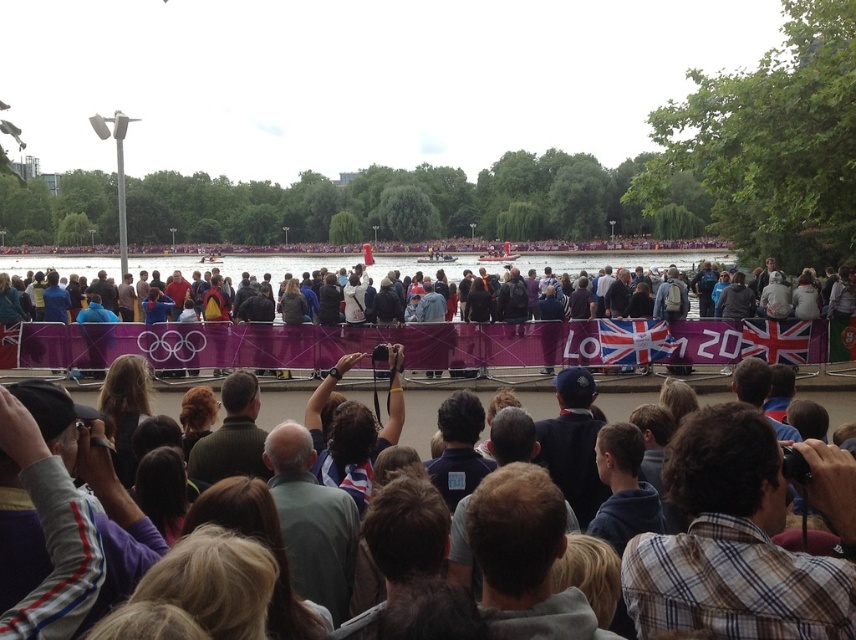
Is brown hair at center taller than light brown hair at center?

Yes, brown hair at center is taller than light brown hair at center.

Is brown hair at center behind light brown hair at center?

No, it is in front of light brown hair at center.

Does point (556, 600) lie in front of point (286, 289)?

Yes, point (556, 600) is closer to viewer.

Locate an element on the screen. brown hair at center is located at coordinates (524, 557).

Can you confirm if green fabric shirt at center is taller than blue fleece jacket at center?

Correct, green fabric shirt at center is much taller as blue fleece jacket at center.

Is point (311, 545) farther from viewer compared to point (629, 465)?

No, (311, 545) is in front of (629, 465).

The height and width of the screenshot is (640, 856). I want to click on green fabric shirt at center, so click(311, 522).

Does green fabric shirt at center appear over blue fabric jacket at left?

No, green fabric shirt at center is not above blue fabric jacket at left.

Between green fabric shirt at center and blue fabric jacket at left, which one is positioned lower?

green fabric shirt at center

I want to click on green fabric shirt at center, so click(311, 522).